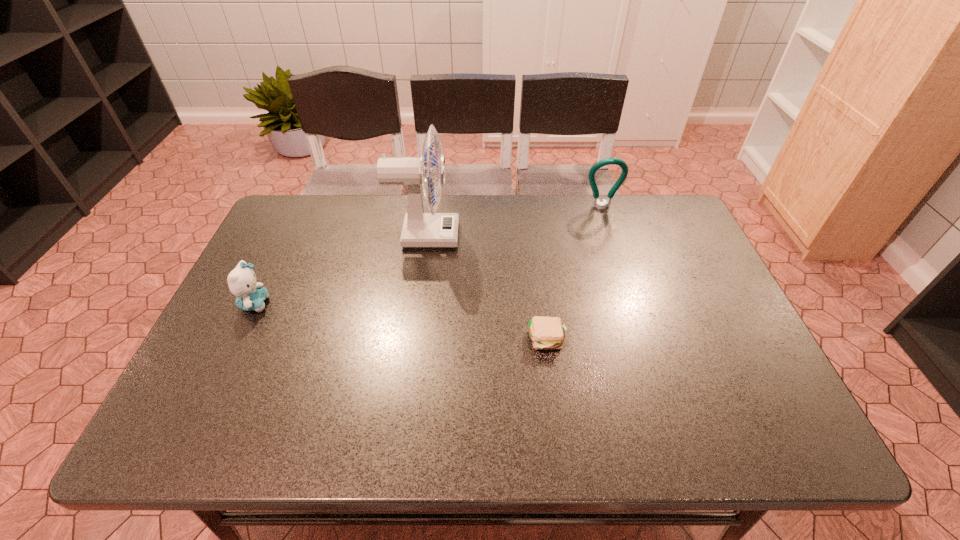
Identify the location of vacant area between the third object from left to right and the third tallest object. This screenshot has width=960, height=540. (401, 321).

This screenshot has height=540, width=960. In order to click on object that can be found as the second closest to the third tallest object in this screenshot , I will do `click(546, 333)`.

In order to click on object identified as the second closest to the nearest object in this screenshot , I will do `click(596, 203)`.

Find the location of a particular element. Image resolution: width=960 pixels, height=540 pixels. vacant space that satisfies the following two spatial constraints: 1. at the jaws of the rightmost object; 2. on the front-facing side of the tallest object is located at coordinates (611, 235).

This screenshot has width=960, height=540. Identify the location of vacant space that satisfies the following two spatial constraints: 1. at the jaws of the bottle opener; 2. on the front-facing side of the fan. (611, 235).

Where is `free space in the image that satisfies the following two spatial constraints: 1. at the jaws of the rightmost object; 2. on the front-facing side of the second object from left to right`? This screenshot has width=960, height=540. free space in the image that satisfies the following two spatial constraints: 1. at the jaws of the rightmost object; 2. on the front-facing side of the second object from left to right is located at coordinates (x=611, y=235).

Where is `vacant space that satisfies the following two spatial constraints: 1. at the jaws of the bottle opener; 2. on the face of the second nearest object`? The width and height of the screenshot is (960, 540). vacant space that satisfies the following two spatial constraints: 1. at the jaws of the bottle opener; 2. on the face of the second nearest object is located at coordinates (633, 303).